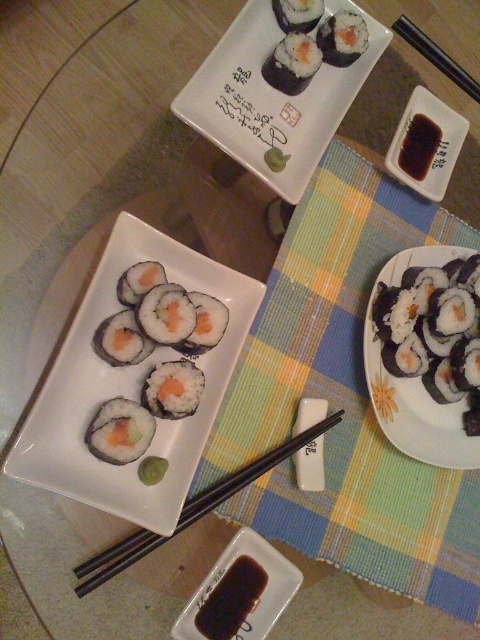
You are a guest at a sushi dinner and want to choose the first plate to eat. You notice there are two plates in front of you. Which plate is positioned higher on the table between the white glossy plate at center and the white glossy rectangular plate at upper center?

The white glossy rectangular plate at upper center is positioned higher on the table compared to the white glossy plate at center, which is located below it.

You are a food critic who needs to taste both the black matte sushi rolls at center and the sushi at center. Given that your arm can reach 16 inches, can you reach both items without moving your chair?

The black matte sushi rolls at center and the sushi at center are 15.70 inches apart. Since your arm can reach 16 inches, you can reach both items without moving your chair.

You are a food critic analyzing the placement of the sushi rolls on the table. The table has a coordinate system where the bottom left corner is the origin point. The sushi rolls are placed at specific coordinates. Which sushi roll is located at the point with coordinates (120, 432)?

The point with coordinates (120, 432) corresponds to the green rice roll at center.